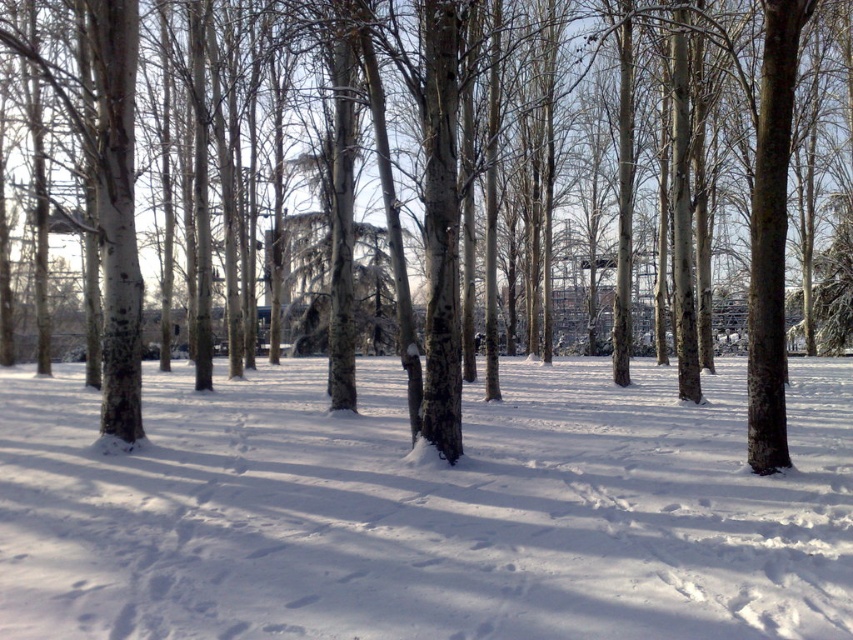
Question: Which point is closer to the camera taking this photo?

Choices:
 (A) click(746, 515)
 (B) click(503, 45)

Answer: (A)

Question: Considering the relative positions of white powdery snow at center and brown bark tree at center in the image provided, where is white powdery snow at center located with respect to brown bark tree at center?

Choices:
 (A) below
 (B) above

Answer: (A)

Question: Which point is farther to the camera?

Choices:
 (A) (161, 422)
 (B) (763, 269)

Answer: (A)

Question: Is white powdery snow at center to the left of brown bark tree at center from the viewer's perspective?

Choices:
 (A) no
 (B) yes

Answer: (A)

Question: Does white powdery snow at center appear under brown bark tree at center?

Choices:
 (A) no
 (B) yes

Answer: (B)